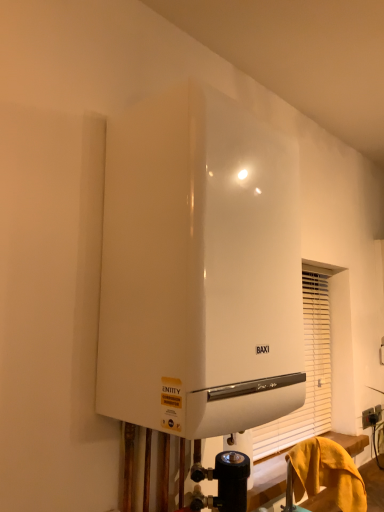
Question: Does black plastic electric outlet at lower right have a lesser height compared to yellow fabric at lower right?

Choices:
 (A) yes
 (B) no

Answer: (A)

Question: Is black plastic electric outlet at lower right oriented towards yellow fabric at lower right?

Choices:
 (A) no
 (B) yes

Answer: (A)

Question: Does black plastic electric outlet at lower right have a larger size compared to yellow fabric at lower right?

Choices:
 (A) yes
 (B) no

Answer: (B)

Question: Is the position of black plastic electric outlet at lower right less distant than that of yellow fabric at lower right?

Choices:
 (A) yes
 (B) no

Answer: (B)

Question: Is black plastic electric outlet at lower right positioned with its back to yellow fabric at lower right?

Choices:
 (A) yes
 (B) no

Answer: (B)

Question: Is white glossy boiler at upper center in front of or behind black plastic electric outlet at lower right in the image?

Choices:
 (A) front
 (B) behind

Answer: (A)

Question: From their relative heights in the image, would you say white glossy boiler at upper center is taller or shorter than black plastic electric outlet at lower right?

Choices:
 (A) short
 (B) tall

Answer: (B)

Question: Considering the positions of white glossy boiler at upper center and black plastic electric outlet at lower right in the image, is white glossy boiler at upper center bigger or smaller than black plastic electric outlet at lower right?

Choices:
 (A) small
 (B) big

Answer: (B)

Question: From a real-world perspective, is white glossy boiler at upper center above or below black plastic electric outlet at lower right?

Choices:
 (A) below
 (B) above

Answer: (B)

Question: Is yellow fabric at lower right wider or thinner than white glossy boiler at upper center?

Choices:
 (A) thin
 (B) wide

Answer: (A)

Question: From the image's perspective, is yellow fabric at lower right located above or below white glossy boiler at upper center?

Choices:
 (A) below
 (B) above

Answer: (A)

Question: Is yellow fabric at lower right taller or shorter than white glossy boiler at upper center?

Choices:
 (A) tall
 (B) short

Answer: (B)

Question: From a real-world perspective, is yellow fabric at lower right physically located above or below white glossy boiler at upper center?

Choices:
 (A) above
 (B) below

Answer: (B)

Question: Would you say white glossy boiler at upper center is inside or outside yellow fabric at lower right?

Choices:
 (A) outside
 (B) inside

Answer: (A)

Question: Considering the positions of white glossy boiler at upper center and yellow fabric at lower right in the image, is white glossy boiler at upper center taller or shorter than yellow fabric at lower right?

Choices:
 (A) tall
 (B) short

Answer: (A)